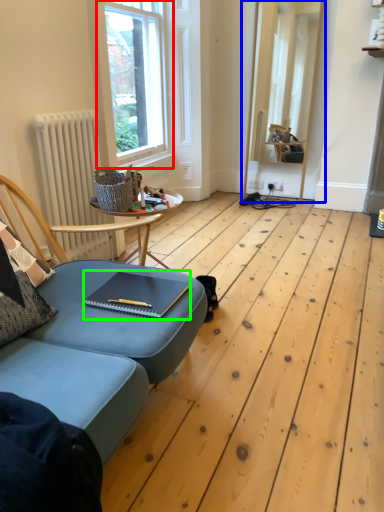
Question: Considering the real-world distances, which object is farthest from window (highlighted by a red box)? window frame (highlighted by a blue box) or notebook (highlighted by a green box)?

Choices:
 (A) window frame
 (B) notebook

Answer: (B)